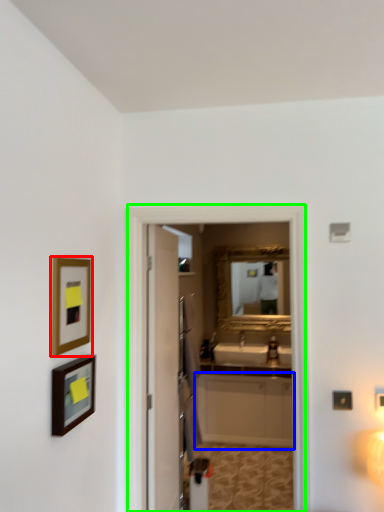
Question: Based on their relative distances, which object is nearer to picture frame (highlighted by a red box)? Choose from cabinetry (highlighted by a blue box) and screen door (highlighted by a green box).

Choices:
 (A) cabinetry
 (B) screen door

Answer: (B)